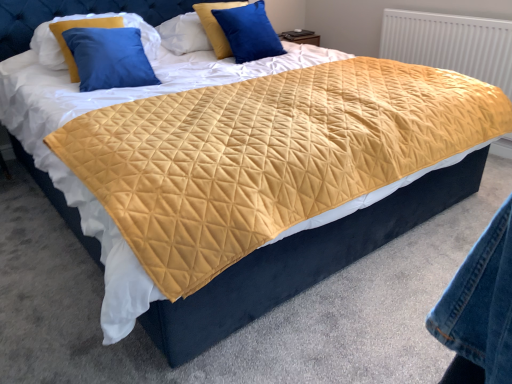
Measure the distance between point (139, 16) and camera.

They are 8.67 feet apart.

What do you see at coordinates (249, 32) in the screenshot? I see `blue velvet pillow at upper center, the 1th pillow positioned from the right` at bounding box center [249, 32].

This screenshot has width=512, height=384. Identify the location of white textured radiator at upper right. (450, 44).

Can you confirm if blue velvet pillow at upper center, the 1th pillow positioned from the right, is positioned to the left of quilted yellow fabric at center?

Indeed, blue velvet pillow at upper center, the 1th pillow positioned from the right, is positioned on the left side of quilted yellow fabric at center.

Does blue velvet pillow at upper center, arranged as the 3th pillow when viewed from the left, contain quilted yellow fabric at center?

No, quilted yellow fabric at center is not surrounded by blue velvet pillow at upper center, arranged as the 3th pillow when viewed from the left.

From the image's perspective, would you say blue velvet pillow at upper center, the 1th pillow positioned from the right, is positioned over quilted yellow fabric at center?

Yes, from the image's perspective, blue velvet pillow at upper center, the 1th pillow positioned from the right, is on top of quilted yellow fabric at center.

From a real-world perspective, between blue velvet pillow at upper center, the 1th pillow positioned from the right, and quilted yellow fabric at center, who is vertically lower?

From a 3D spatial view, quilted yellow fabric at center is below.

Between point (261, 46) and point (180, 40), which one is positioned behind?

The point (180, 40) is farther.

Is blue velvet pillow at upper center, the 1th pillow positioned from the right, next to blue velvet pillow at upper center, the second pillow from the right, and touching it?

No, blue velvet pillow at upper center, the 1th pillow positioned from the right, is not making contact with blue velvet pillow at upper center, the second pillow from the right.

Is blue velvet pillow at upper center, the 1th pillow positioned from the right, at the right side of blue velvet pillow at upper center, positioned as the second pillow in left-to-right order?

Correct, you'll find blue velvet pillow at upper center, the 1th pillow positioned from the right, to the right of blue velvet pillow at upper center, positioned as the second pillow in left-to-right order.

Can you confirm if blue velvet pillow at upper center, arranged as the 3th pillow when viewed from the left, is bigger than blue velvet pillow at upper center, positioned as the second pillow in left-to-right order?

No, blue velvet pillow at upper center, arranged as the 3th pillow when viewed from the left, is not bigger than blue velvet pillow at upper center, positioned as the second pillow in left-to-right order.

Is quilted yellow fabric at center next to velvet blue pillow at upper left, which ranks as the third pillow in right-to-left order, and touching it?

They are not placed beside each other.

Does quilted yellow fabric at center appear on the right side of velvet blue pillow at upper left, which ranks as the third pillow in right-to-left order?

Yes, quilted yellow fabric at center is to the right of velvet blue pillow at upper left, which ranks as the third pillow in right-to-left order.

Which point is more distant from viewer, (432, 204) or (42, 58)?

Point (42, 58)

From the image's perspective, which one is positioned higher, quilted yellow fabric at center or velvet blue pillow at upper left, placed as the first pillow when sorted from left to right?

velvet blue pillow at upper left, placed as the first pillow when sorted from left to right, from the image's perspective.

Which is more to the left, velvet blue pillow at upper left, which ranks as the third pillow in right-to-left order, or blue velvet pillow at upper center, the second pillow from the right?

Positioned to the left is velvet blue pillow at upper left, which ranks as the third pillow in right-to-left order.

Consider the image. Can we say velvet blue pillow at upper left, placed as the first pillow when sorted from left to right, lies outside blue velvet pillow at upper center, positioned as the second pillow in left-to-right order?

Absolutely, velvet blue pillow at upper left, placed as the first pillow when sorted from left to right, is external to blue velvet pillow at upper center, positioned as the second pillow in left-to-right order.

Does velvet blue pillow at upper left, placed as the first pillow when sorted from left to right, have a lesser width compared to blue velvet pillow at upper center, positioned as the second pillow in left-to-right order?

In fact, velvet blue pillow at upper left, placed as the first pillow when sorted from left to right, might be wider than blue velvet pillow at upper center, positioned as the second pillow in left-to-right order.

Consider the image. Does blue velvet pillow at upper center, positioned as the second pillow in left-to-right order, have a smaller size compared to velvet blue pillow at upper left, which ranks as the third pillow in right-to-left order?

Yes, blue velvet pillow at upper center, positioned as the second pillow in left-to-right order, is smaller than velvet blue pillow at upper left, which ranks as the third pillow in right-to-left order.

From the image's perspective, is blue velvet pillow at upper center, positioned as the second pillow in left-to-right order, under velvet blue pillow at upper left, placed as the first pillow when sorted from left to right?

No, from the image's perspective, blue velvet pillow at upper center, positioned as the second pillow in left-to-right order, is not below velvet blue pillow at upper left, placed as the first pillow when sorted from left to right.

Considering the points (169, 30) and (73, 18), which point is in front, point (169, 30) or point (73, 18)?

Positioned in front is point (73, 18).

From a real-world perspective, which is physically above, quilted yellow fabric at center or blue velvet pillow at upper center, the 1th pillow positioned from the right?

In real-world perspective, blue velvet pillow at upper center, the 1th pillow positioned from the right, is above.

Image resolution: width=512 pixels, height=384 pixels. I want to click on bed frame on the right of the blue velvet pillow at upper center, the 1th pillow positioned from the right, so click(301, 263).

Can you confirm if quilted yellow fabric at center is positioned to the right of blue velvet pillow at upper center, the 1th pillow positioned from the right?

Indeed, quilted yellow fabric at center is positioned on the right side of blue velvet pillow at upper center, the 1th pillow positioned from the right.

Is point (156, 330) closer to camera compared to point (275, 53)?

That is True.

From a real-world perspective, who is located higher, blue velvet pillow at upper center, positioned as the second pillow in left-to-right order, or blue velvet pillow at upper center, the 1th pillow positioned from the right?

blue velvet pillow at upper center, positioned as the second pillow in left-to-right order, from a real-world perspective.

In the scene shown: Which of these two, blue velvet pillow at upper center, positioned as the second pillow in left-to-right order, or blue velvet pillow at upper center, the 1th pillow positioned from the right, is thinner?

blue velvet pillow at upper center, the 1th pillow positioned from the right, is thinner.

How many degrees apart are the facing directions of blue velvet pillow at upper center, positioned as the second pillow in left-to-right order, and blue velvet pillow at upper center, the 1th pillow positioned from the right?

The facing directions of blue velvet pillow at upper center, positioned as the second pillow in left-to-right order, and blue velvet pillow at upper center, the 1th pillow positioned from the right, are 9.35 degrees apart.

Considering the sizes of objects blue velvet pillow at upper center, the second pillow from the right, and blue velvet pillow at upper center, arranged as the 3th pillow when viewed from the left, in the image provided, who is shorter, blue velvet pillow at upper center, the second pillow from the right, or blue velvet pillow at upper center, arranged as the 3th pillow when viewed from the left,?

blue velvet pillow at upper center, the second pillow from the right.

Starting from the quilted yellow fabric at center, which pillow is the 1st one to the left? Please provide its 2D coordinates.

[(249, 32)]

Locate an element on the screen. The height and width of the screenshot is (384, 512). pillow behind the blue velvet pillow at upper center, arranged as the 3th pillow when viewed from the left is located at coordinates (197, 31).

Consider the image. Which object lies nearer to the anchor point velvet blue pillow at upper left, which ranks as the third pillow in right-to-left order, quilted yellow fabric at center or blue velvet pillow at upper center, the 1th pillow positioned from the right?

blue velvet pillow at upper center, the 1th pillow positioned from the right.

Based on their spatial positions, is white textured radiator at upper right or blue velvet pillow at upper center, arranged as the 3th pillow when viewed from the left, further from blue velvet pillow at upper center, the second pillow from the right?

white textured radiator at upper right is positioned further to the anchor blue velvet pillow at upper center, the second pillow from the right.

From the picture: Considering their positions, is blue velvet pillow at upper center, the second pillow from the right, positioned closer to quilted yellow fabric at center than white textured radiator at upper right?

The object closer to quilted yellow fabric at center is white textured radiator at upper right.

Looking at the image, which one is located further to velvet blue pillow at upper left, which ranks as the third pillow in right-to-left order, white textured radiator at upper right or blue velvet pillow at upper center, positioned as the second pillow in left-to-right order?

The object further to velvet blue pillow at upper left, which ranks as the third pillow in right-to-left order, is white textured radiator at upper right.

Based on their spatial positions, is blue velvet pillow at upper center, positioned as the second pillow in left-to-right order, or velvet blue pillow at upper left, which ranks as the third pillow in right-to-left order, further from blue velvet pillow at upper center, arranged as the 3th pillow when viewed from the left?

velvet blue pillow at upper left, which ranks as the third pillow in right-to-left order.

From the image, which object appears to be nearer to quilted yellow fabric at center, blue velvet pillow at upper center, positioned as the second pillow in left-to-right order, or velvet blue pillow at upper left, which ranks as the third pillow in right-to-left order?

Based on the image, blue velvet pillow at upper center, positioned as the second pillow in left-to-right order, appears to be nearer to quilted yellow fabric at center.

Considering their positions, is quilted yellow fabric at center positioned closer to velvet blue pillow at upper left, placed as the first pillow when sorted from left to right, than blue velvet pillow at upper center, the second pillow from the right?

blue velvet pillow at upper center, the second pillow from the right, lies closer to velvet blue pillow at upper left, placed as the first pillow when sorted from left to right, than the other object.

Which object lies nearer to the anchor point quilted yellow fabric at center, white textured radiator at upper right or blue velvet pillow at upper center, positioned as the second pillow in left-to-right order?

The object closer to quilted yellow fabric at center is white textured radiator at upper right.

This screenshot has height=384, width=512. I want to click on bed frame situated between velvet blue pillow at upper left, placed as the first pillow when sorted from left to right, and white textured radiator at upper right from left to right, so click(x=301, y=263).

Where is `pillow between quilted yellow fabric at center and blue velvet pillow at upper center, arranged as the 3th pillow when viewed from the left, from front to back`? The image size is (512, 384). pillow between quilted yellow fabric at center and blue velvet pillow at upper center, arranged as the 3th pillow when viewed from the left, from front to back is located at coordinates (x=88, y=20).

Locate an element on the screen. The width and height of the screenshot is (512, 384). pillow between blue velvet pillow at upper center, the second pillow from the right, and white textured radiator at upper right, in the horizontal direction is located at coordinates (249, 32).

At what (x,y) coordinates should I click in order to perform the action: click on radiator positioned between quilted yellow fabric at center and blue velvet pillow at upper center, positioned as the second pillow in left-to-right order, from near to far. Please return your answer as a coordinate pair (x, y). Looking at the image, I should click on (450, 44).